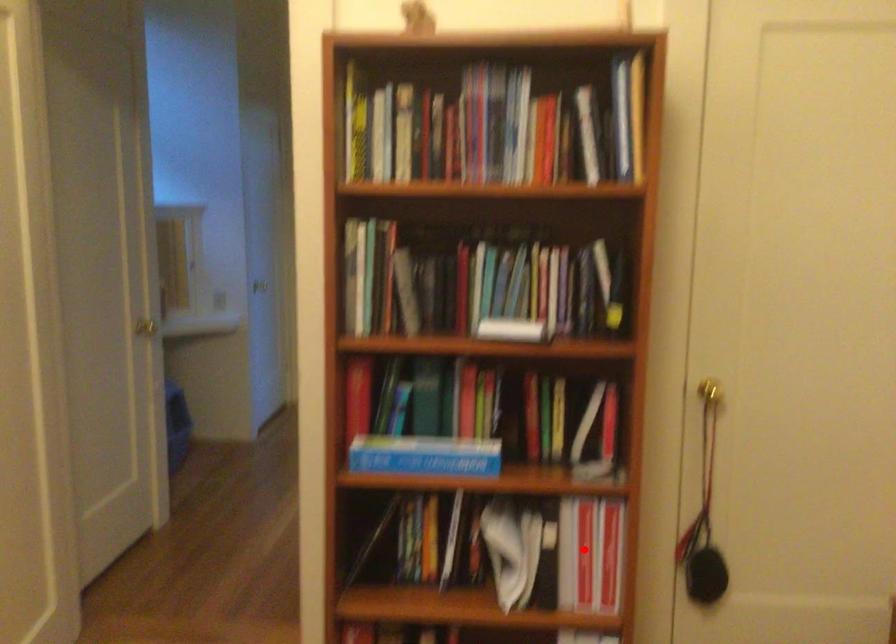
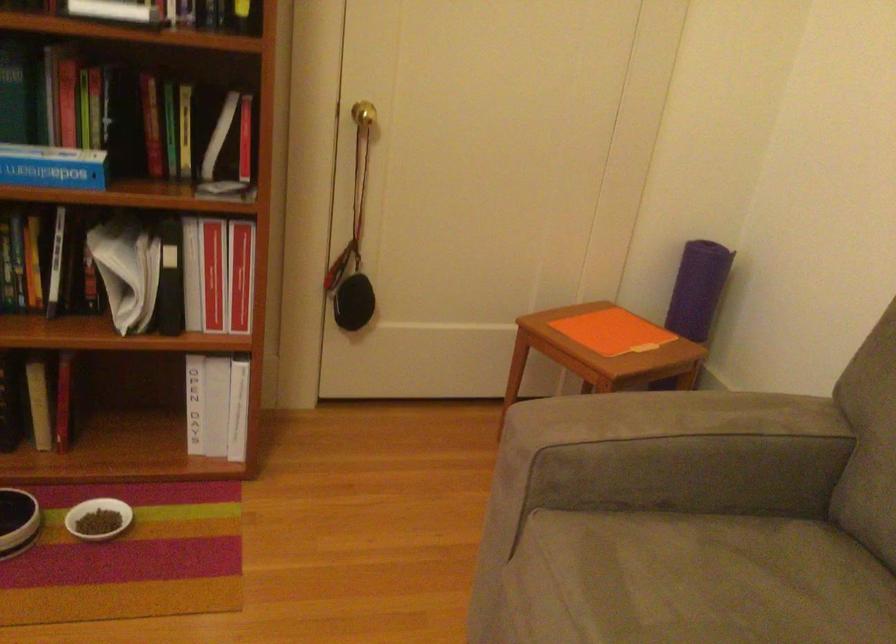
The point at the highlighted location is marked in the first image. Where is the corresponding point in the second image?

(212, 274)